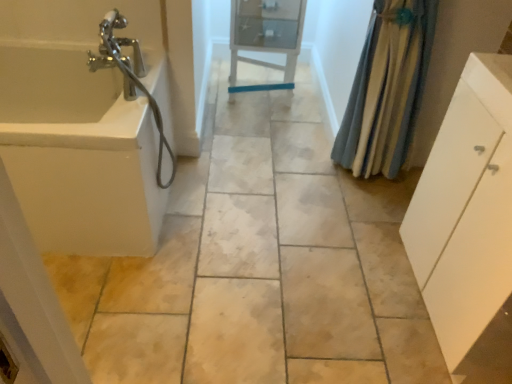
Question: In the image, is white glossy bathtub at left positioned in front of or behind white glossy cabinet at center?

Choices:
 (A) behind
 (B) front

Answer: (B)

Question: In terms of size, does white glossy bathtub at left appear bigger or smaller than white glossy cabinet at center?

Choices:
 (A) small
 (B) big

Answer: (B)

Question: Based on their relative distances, which object is nearer to the white matte cabinet at right?

Choices:
 (A) white glossy cabinet at center
 (B) blue textured fabric shower curtain at right
 (C) white glossy bathtub at left

Answer: (B)

Question: Estimate the real-world distances between objects in this image. Which object is farther from the white glossy cabinet at center?

Choices:
 (A) blue textured fabric shower curtain at right
 (B) white matte cabinet at right
 (C) white glossy bathtub at left

Answer: (B)